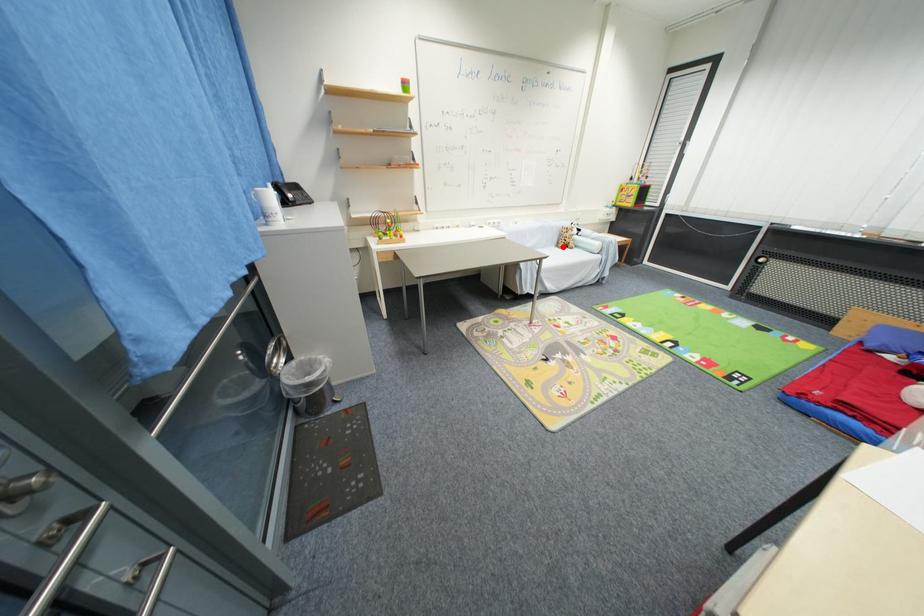
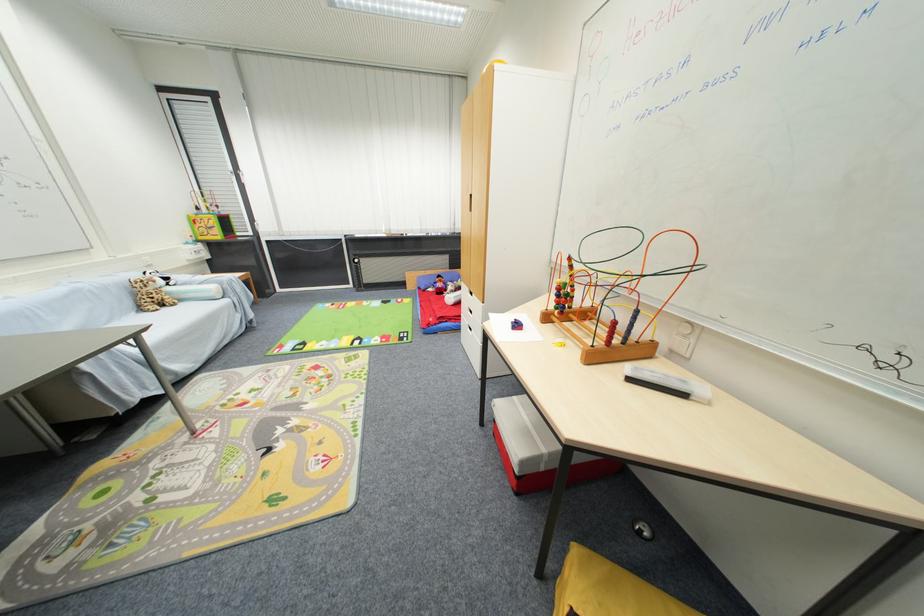
Question: I am providing you with two images of the same scene from different viewpoints. Given a red point in image1, look at the same physical point in image2. Is it:

Choices:
 (A) Closer to the viewpoint
 (B) Farther from the viewpoint

Answer: (A)